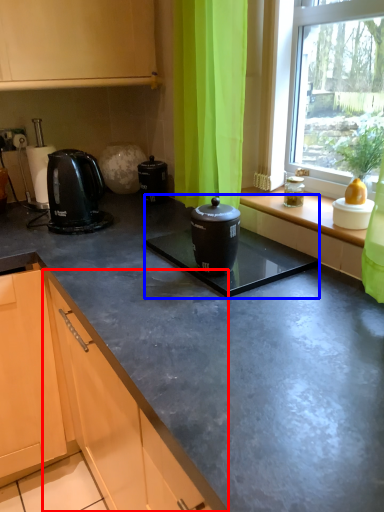
Question: Among these objects, which one is nearest to the camera, cabinetry (highlighted by a red box) or sink (highlighted by a blue box)?

Choices:
 (A) cabinetry
 (B) sink

Answer: (B)